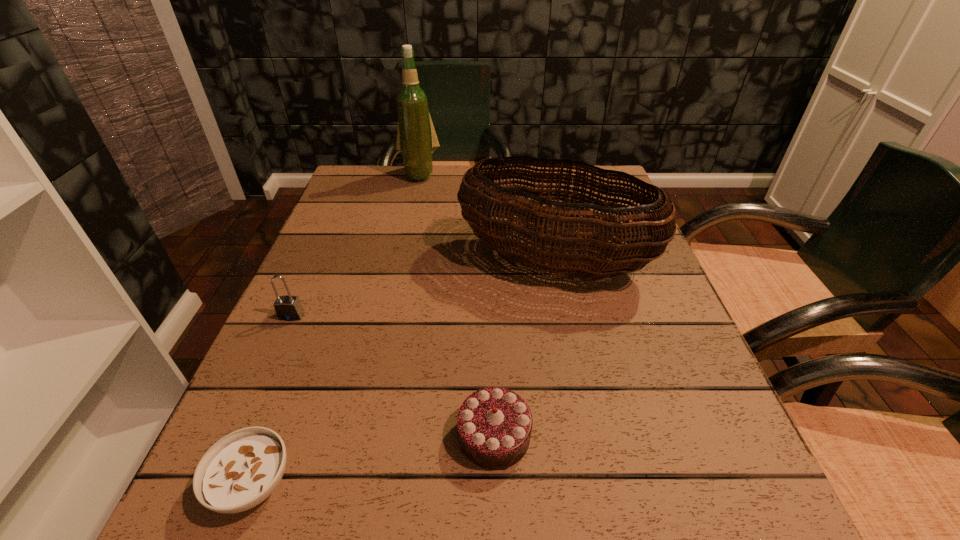
Locate an element on the screen. This screenshot has height=540, width=960. vacant position located on the shackle of the third farthest object is located at coordinates (237, 437).

Where is `vacant space located 0.200m on the left of the fourth tallest object`? The image size is (960, 540). vacant space located 0.200m on the left of the fourth tallest object is located at coordinates (325, 435).

You are a GUI agent. You are given a task and a screenshot of the screen. Output one action in this format:
    pyautogui.click(x=<x>, y=<y>)
    Task: Click on the vacant region located 0.290m on the back of the soup bowl
    The width and height of the screenshot is (960, 540).
    Given the screenshot: What is the action you would take?
    pyautogui.click(x=321, y=308)

You are a GUI agent. You are given a task and a screenshot of the screen. Output one action in this format:
    pyautogui.click(x=<x>, y=<y>)
    Task: Click on the object at the far edge
    This screenshot has width=960, height=540.
    Given the screenshot: What is the action you would take?
    pyautogui.click(x=416, y=138)

Find the location of a particular element. The image size is (960, 540). object situated at the near edge is located at coordinates (242, 469).

What are the coordinates of `wine bottle that is at the left edge` in the screenshot? It's located at (416, 138).

Find the location of a particular element. The height and width of the screenshot is (540, 960). padlock that is at the left edge is located at coordinates (287, 308).

The height and width of the screenshot is (540, 960). I want to click on soup bowl that is at the left edge, so [242, 469].

Locate an element on the screen. Image resolution: width=960 pixels, height=540 pixels. object positioned at the right edge is located at coordinates (563, 252).

This screenshot has width=960, height=540. I want to click on object that is positioned at the far left corner, so click(416, 138).